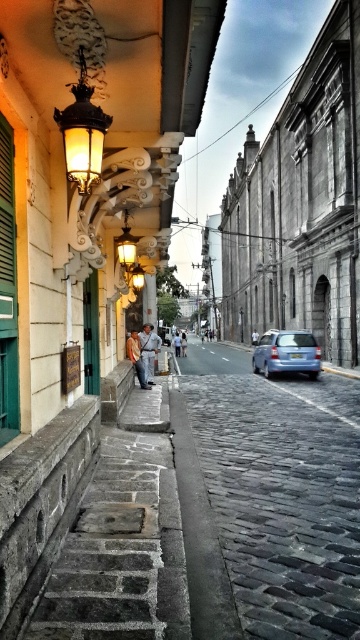
Question: Is cobblestone pavement at center to the left of green painted wood shutter at left from the viewer's perspective?

Choices:
 (A) yes
 (B) no

Answer: (B)

Question: Does stone textured stairs at lower left appear under green painted wood shutter at left?

Choices:
 (A) no
 (B) yes

Answer: (B)

Question: Estimate the real-world distances between objects in this image. Which object is closer to the green painted wood shutter at left?

Choices:
 (A) stone textured stairs at lower left
 (B) denim jacket at center
 (C) blue matte car at center

Answer: (A)

Question: Among these objects, which one is nearest to the camera?

Choices:
 (A) green painted wood shutter at left
 (B) cobblestone pavement at center
 (C) denim jacket at center
 (D) blue matte car at center

Answer: (B)

Question: Which point is closer to the camera?

Choices:
 (A) (127, 497)
 (B) (177, 413)
 (C) (253, 355)
 (D) (149, 358)

Answer: (A)

Question: Is stone textured stairs at lower left smaller than green painted wood shutter at left?

Choices:
 (A) yes
 (B) no

Answer: (B)